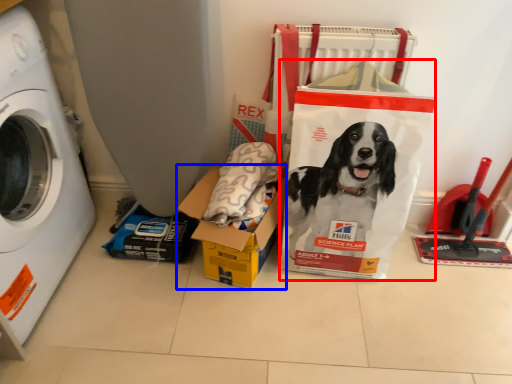
Question: Which object appears closest to the camera in this image, paper bag (highlighted by a red box) or box (highlighted by a blue box)?

Choices:
 (A) paper bag
 (B) box

Answer: (A)